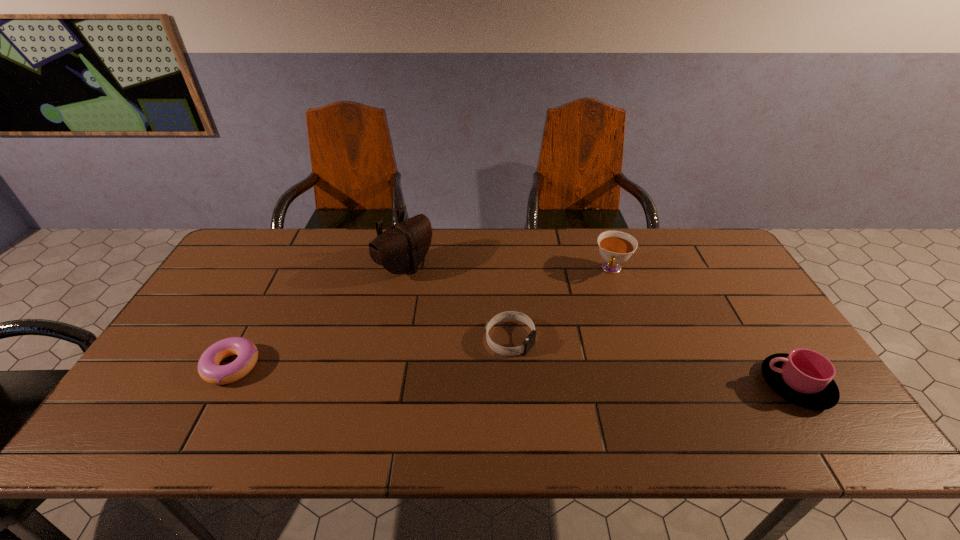
The width and height of the screenshot is (960, 540). I want to click on blank area located 0.070m on the side with the handle of the cup, so (733, 385).

Identify the location of vacant space positioned on the side with the handle of the cup. tap(664, 385).

Locate an element on the screen. The height and width of the screenshot is (540, 960). free space located on the outer surface of the third object from right to left is located at coordinates (x=580, y=375).

I want to click on vacant space located 0.150m on the outer surface of the third object from right to left, so click(x=584, y=377).

This screenshot has height=540, width=960. Identify the location of free region located 0.060m on the outer surface of the third object from right to left. (551, 360).

The height and width of the screenshot is (540, 960). I want to click on free space located 0.090m on the side of the teacup with the handle, so click(603, 300).

What are the coordinates of `free space located on the side of the teacup with the handle` in the screenshot? It's located at (596, 321).

Where is `free region located on the side of the teacup with the handle`? free region located on the side of the teacup with the handle is located at coordinates (596, 323).

This screenshot has width=960, height=540. Find the location of `vacant space located with the flap open on the pouch`. vacant space located with the flap open on the pouch is located at coordinates (460, 301).

At what (x,y) coordinates should I click in order to perform the action: click on vacant space located with the flap open on the pouch. Please return your answer as a coordinate pair (x, y). Image resolution: width=960 pixels, height=540 pixels. Looking at the image, I should click on (452, 297).